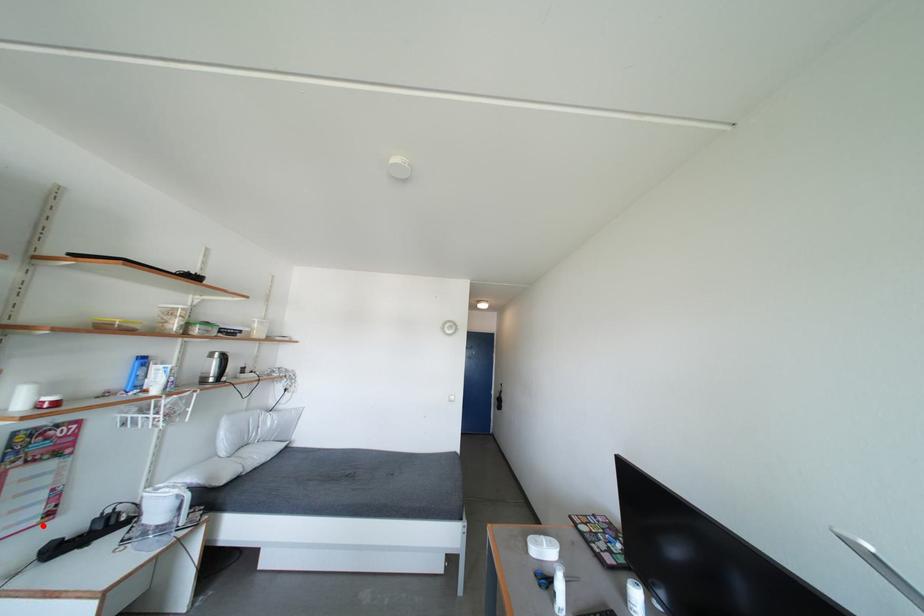
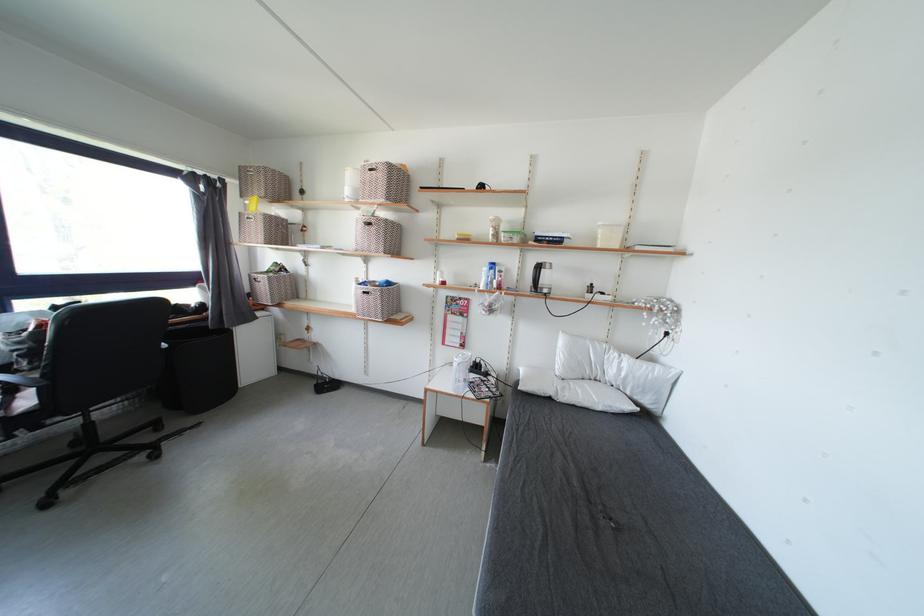
Question: I am providing you with two images of the same scene from different viewpoints. In image1, a red point is highlighted. Considering the same 3D point in image2, which of the following is correct?

Choices:
 (A) It is closer
 (B) It is farther

Answer: (A)